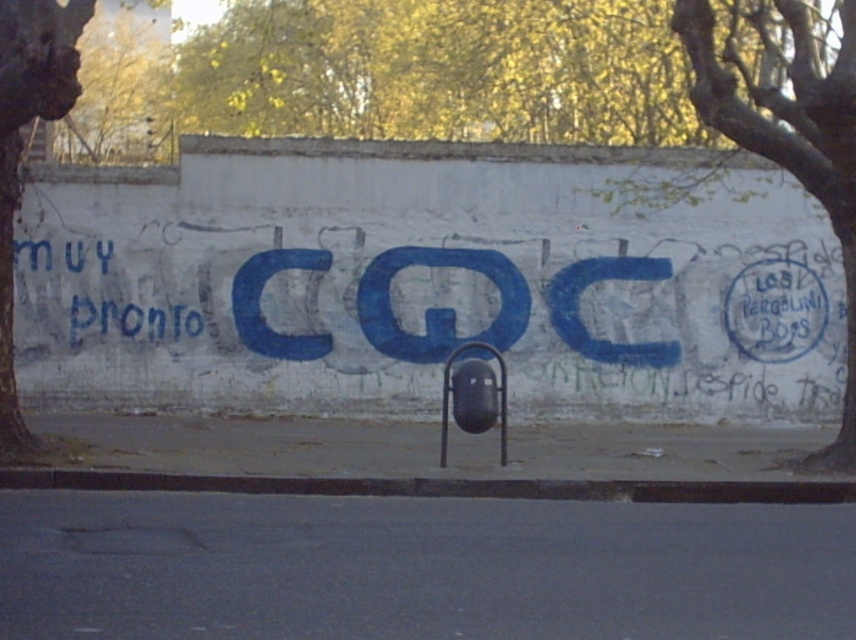
You are an artist planning to paint a mural on this wall. You want to add a new element between the green leafy tree at upper right and the green rough bark tree at left. Considering their widths, which tree should you place closer to the center of the wall to maintain balance?

Since the green leafy tree at upper right is wider than the green rough bark tree at left, you should place the new element closer to the green rough bark tree at left to balance the composition.

You are an artist standing in front of the wall with graffiti. You want to touch the exact center of the wall. Where should you aim? Is it the blue paint at center?

Yes, the blue paint at center is located at point (x=421, y=323), which is very close to the exact center of the wall. You should aim for the blue paint at center.

Looking at this image, you are an artist planning to add a new mural next to the blue paint at center. Considering the existing yellow leafy tree at upper left, where should you place your new mural to avoid blocking the tree?

The blue paint at center is positioned under the yellow leafy tree at upper left. To avoid blocking the tree, place the new mural to the right or left side of the blue paint at center, away from the area directly under the tree.